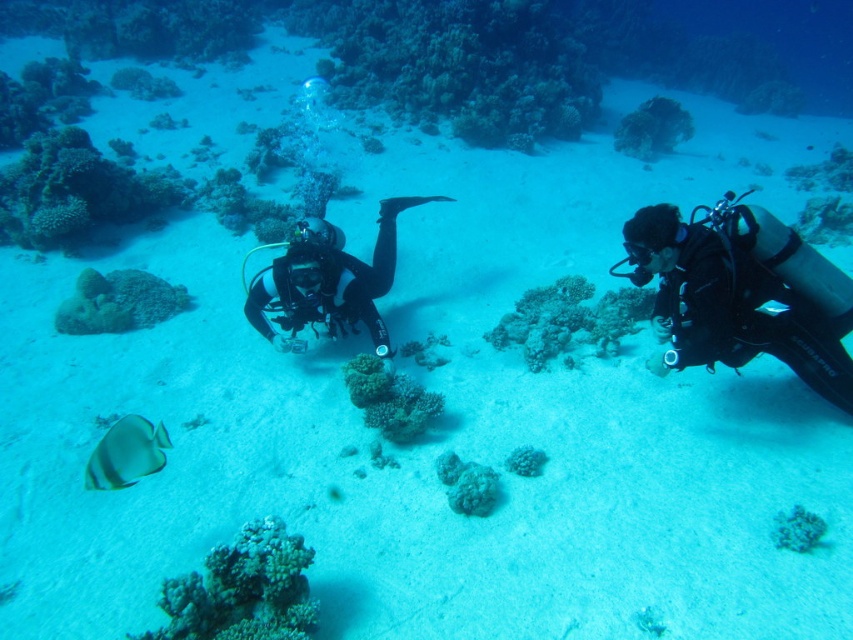
Question: Is black matte scuba diver at right wider than green matte coral at center?

Choices:
 (A) yes
 (B) no

Answer: (A)

Question: Which object appears farthest from the camera in this image?

Choices:
 (A) smooth coral at center
 (B) translucent yellowish-green fish at lower left
 (C) black matte scuba diver at right

Answer: (A)

Question: Among these objects, which one is nearest to the camera?

Choices:
 (A) smooth white coral at center
 (B) translucent blue coral at center

Answer: (B)

Question: Can you confirm if translucent yellowish-green fish at lower left is thinner than smooth white coral at center?

Choices:
 (A) no
 (B) yes

Answer: (A)

Question: Can you confirm if black matte scuba diver at center is positioned to the right of smooth white coral at center?

Choices:
 (A) no
 (B) yes

Answer: (A)

Question: Among these points, which one is nearest to the camera?

Choices:
 (A) (780, 545)
 (B) (467, 493)

Answer: (A)